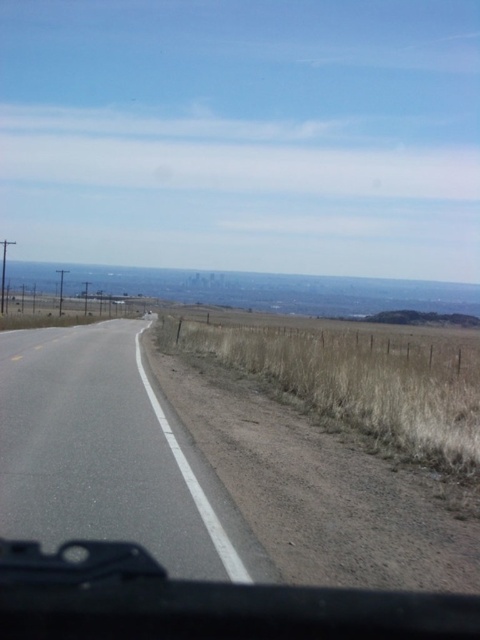
Does dry grass at right have a larger size compared to urban skyline at center?

Incorrect, dry grass at right is not larger than urban skyline at center.

Does dry grass at right have a smaller size compared to urban skyline at center?

Yes, dry grass at right is smaller than urban skyline at center.

Is point (351, 397) less distant than point (371, 308)?

That is True.

At what (x,y) coordinates should I click in order to perform the action: click on dry grass at right. Please return your answer as a coordinate pair (x, y). This screenshot has height=640, width=480. Looking at the image, I should click on (357, 385).

What do you see at coordinates (107, 454) in the screenshot?
I see `asphalt road at center` at bounding box center [107, 454].

Can you confirm if asphalt road at center is thinner than urban skyline at center?

Correct, asphalt road at center's width is less than urban skyline at center's.

Where is `asphalt road at center`? This screenshot has width=480, height=640. asphalt road at center is located at coordinates (107, 454).

The image size is (480, 640). Find the location of `asphalt road at center`. asphalt road at center is located at coordinates (107, 454).

This screenshot has width=480, height=640. Describe the element at coordinates (107, 454) in the screenshot. I see `asphalt road at center` at that location.

Does point (200, 493) come farther from viewer compared to point (324, 342)?

No, (200, 493) is closer to viewer.

Who is more forward, (24, 406) or (279, 342)?

Positioned in front is point (24, 406).

Find the location of a particular element. This screenshot has height=640, width=480. asphalt road at center is located at coordinates (107, 454).